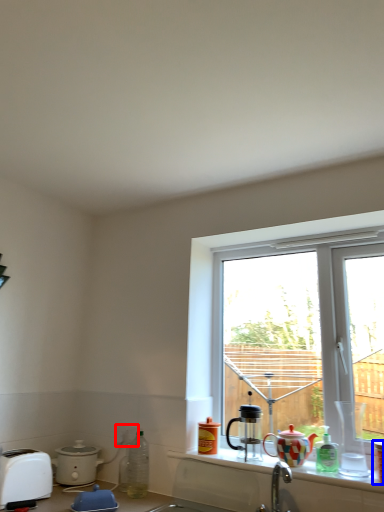
Question: Which point is further to the camera, electric outlet (highlighted by a red box) or coffee cup (highlighted by a blue box)?

Choices:
 (A) electric outlet
 (B) coffee cup

Answer: (A)